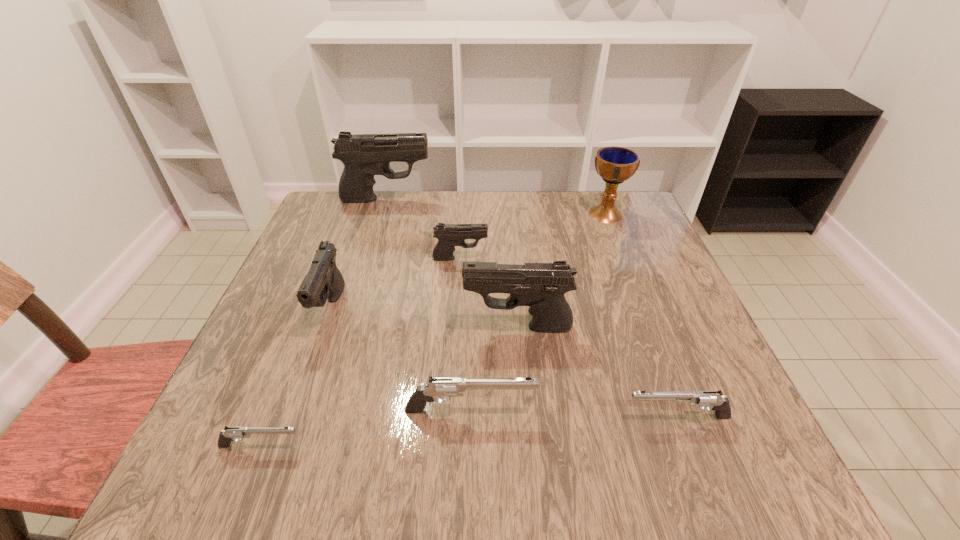
Where is `object present at the far left corner`? object present at the far left corner is located at coordinates coord(364,155).

The width and height of the screenshot is (960, 540). In order to click on object that is at the near left corner in this screenshot , I will do `click(230, 434)`.

Find the location of a particular element. Image resolution: width=960 pixels, height=540 pixels. object located at the far right corner is located at coordinates (615, 165).

The width and height of the screenshot is (960, 540). What are the coordinates of `vacant space at the far edge of the desktop` in the screenshot? It's located at (398, 197).

In the image, there is a desktop. Identify the location of vacant space at the near edge. This screenshot has width=960, height=540. (337, 486).

Locate an element on the screen. free location at the left edge is located at coordinates (297, 269).

In the image, there is a desktop. Find the location of `vacant area at the right edge`. vacant area at the right edge is located at coordinates (664, 328).

Identify the location of free region at the near right corner. Image resolution: width=960 pixels, height=540 pixels. (681, 443).

I want to click on empty space between the second silver pistol from right to left and the shortest object, so click(x=366, y=428).

Find the location of a particular element. Image resolution: width=960 pixels, height=540 pixels. empty location between the smallest black pistol and the leftmost silver pistol is located at coordinates (360, 352).